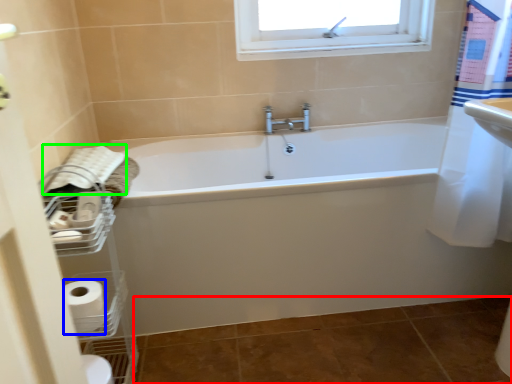
Question: Which object is the farthest from ceramic tile (highlighted by a red box)? Choose among these: toilet paper (highlighted by a blue box) or bath towel (highlighted by a green box).

Choices:
 (A) toilet paper
 (B) bath towel

Answer: (B)